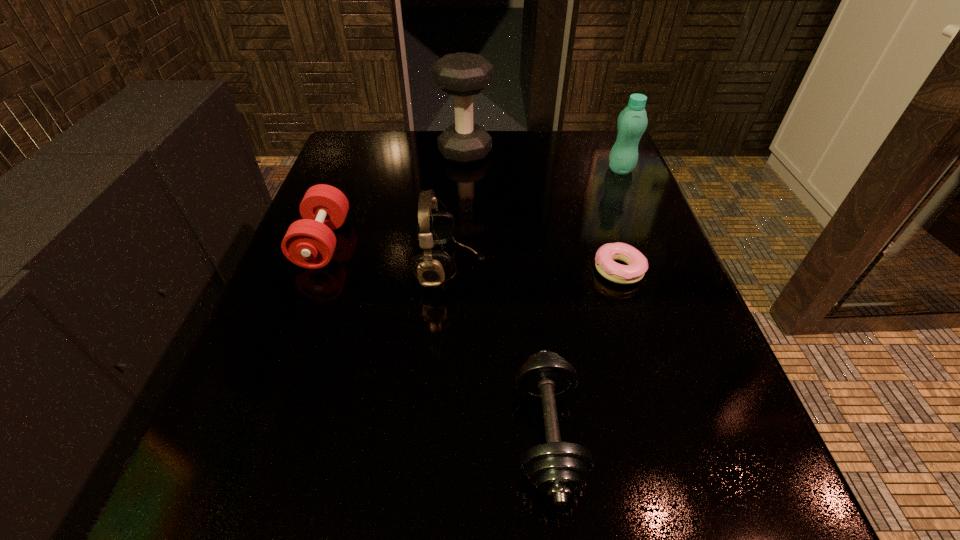
Where is `bottle that is at the right edge`? bottle that is at the right edge is located at coordinates (632, 122).

You are a GUI agent. You are given a task and a screenshot of the screen. Output one action in this format:
    pyautogui.click(x=<x>, y=<y>)
    Task: Click on the doughnut positioned at the right edge
    The height and width of the screenshot is (540, 960).
    Given the screenshot: What is the action you would take?
    pyautogui.click(x=637, y=263)

Find the location of a particular element. This screenshot has width=960, height=540. object that is at the far right corner is located at coordinates (632, 122).

The image size is (960, 540). Identify the location of free region at the far edge of the desktop. (458, 173).

Locate an element on the screen. The image size is (960, 540). free space at the near edge of the desktop is located at coordinates (406, 498).

Where is `vacant space at the left edge of the desktop`? The height and width of the screenshot is (540, 960). vacant space at the left edge of the desktop is located at coordinates (243, 408).

You are a GUI agent. You are given a task and a screenshot of the screen. Output one action in this format:
    pyautogui.click(x=<x>, y=<y>)
    Task: Click on the free location at the right edge of the desktop
    The image size is (960, 540).
    Given the screenshot: What is the action you would take?
    pyautogui.click(x=632, y=324)

Identify the location of vacant space at the far left corner of the desktop. (371, 148).

You are a GUI agent. You are given a task and a screenshot of the screen. Output one action in this format:
    pyautogui.click(x=<x>, y=<y>)
    Task: Click on the free space at the near left corner of the desktop
    The width and height of the screenshot is (960, 540).
    Given the screenshot: What is the action you would take?
    pyautogui.click(x=204, y=516)

Where is `vacant area that lies between the fifth object from left to right and the rightmost object`? vacant area that lies between the fifth object from left to right and the rightmost object is located at coordinates (620, 219).